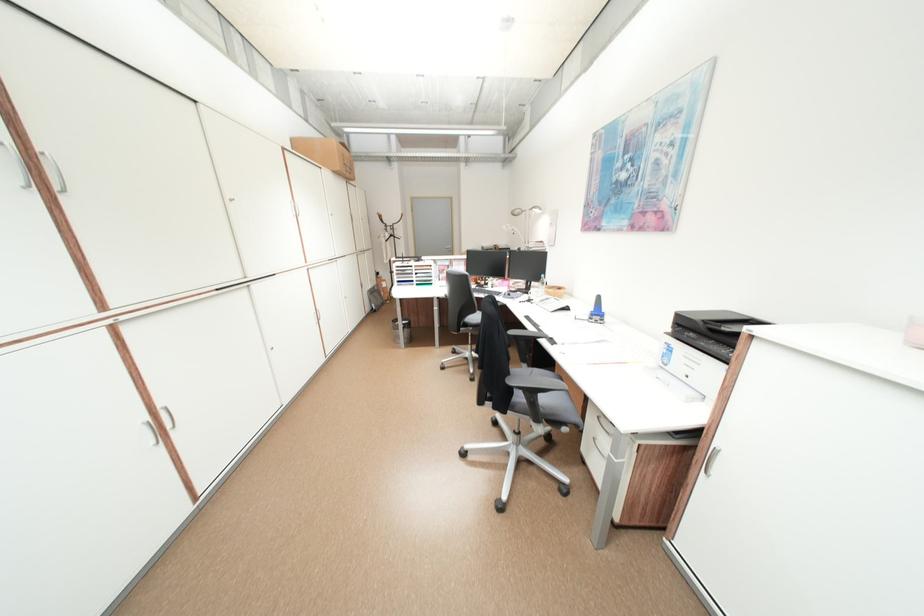
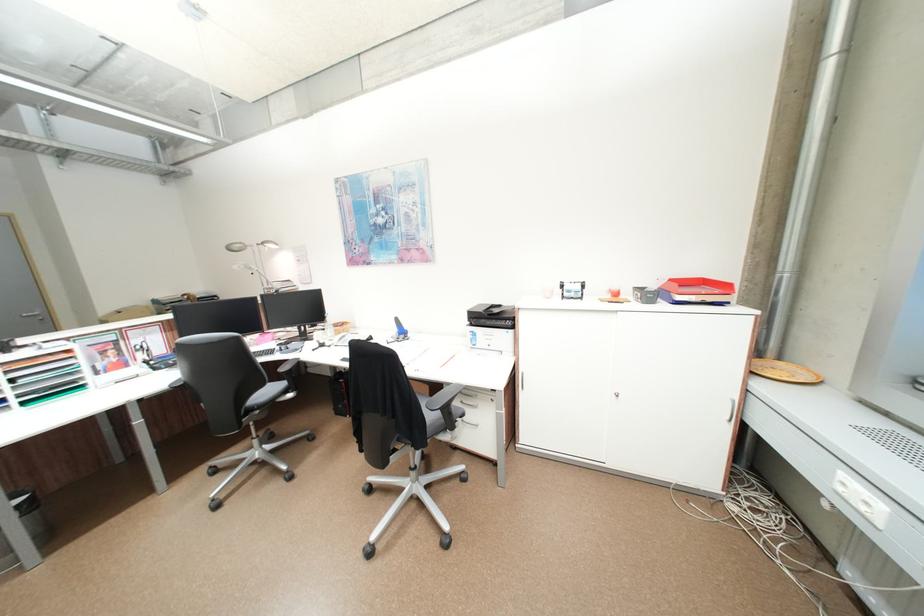
Question: The camera is either moving clockwise (left) or counter-clockwise (right) around the object. The first image is from the beginning of the video and the second image is from the end. Is the camera moving left or right when shooting the video?

Choices:
 (A) Left
 (B) Right

Answer: (A)